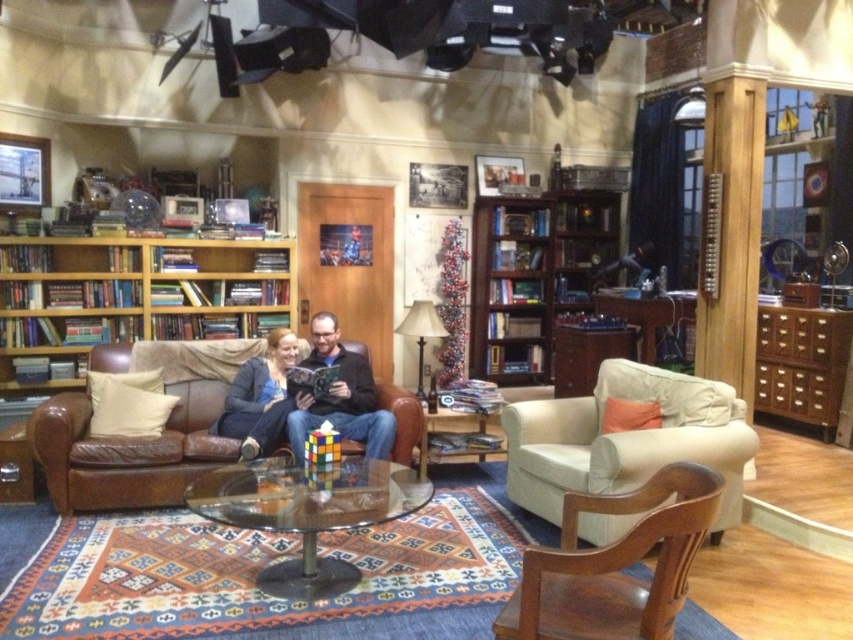
You are standing at the entrance of the living room and want to place a new lamp on the beige fabric armchair at center. According to the coordinates provided, where exactly should you place the lamp?

The beige fabric armchair at center is located at coordinates point (625, 440), so you should place the lamp there.